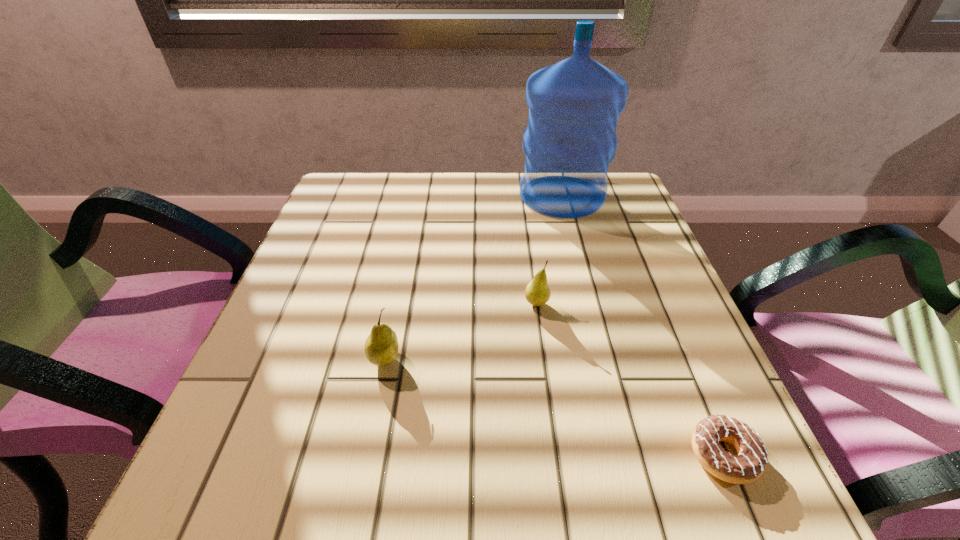
What are the coordinates of `the tallest object` in the screenshot? It's located at (574, 105).

Locate an element on the screen. the farthest object is located at coordinates (574, 105).

Image resolution: width=960 pixels, height=540 pixels. I want to click on the second farthest object, so click(537, 292).

What are the coordinates of `the right pear` in the screenshot? It's located at (537, 292).

Where is `the left pear`? the left pear is located at coordinates pos(381,347).

Locate an element on the screen. the second nearest object is located at coordinates (381, 347).

Where is `the nearest object`? This screenshot has height=540, width=960. the nearest object is located at coordinates (750, 463).

Where is `doughnut`? The width and height of the screenshot is (960, 540). doughnut is located at coordinates (750, 463).

What are the coordinates of `vacant space located 0.270m on the left of the tallest object` in the screenshot? It's located at (412, 195).

Find the location of a particular element. vacant space situated 0.050m on the right of the farther pear is located at coordinates (576, 303).